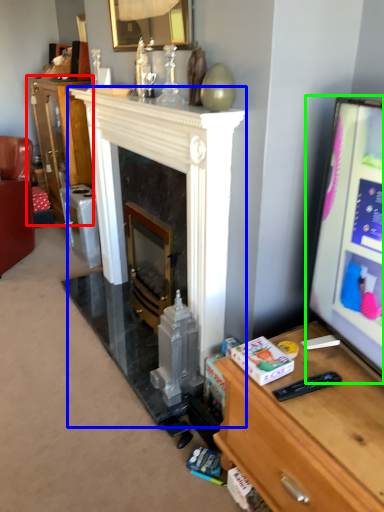
Question: Which object is positioned farthest from cabinetry (highlighted by a red box)? Select from fireplace (highlighted by a blue box) and computer monitor (highlighted by a green box).

Choices:
 (A) fireplace
 (B) computer monitor

Answer: (B)